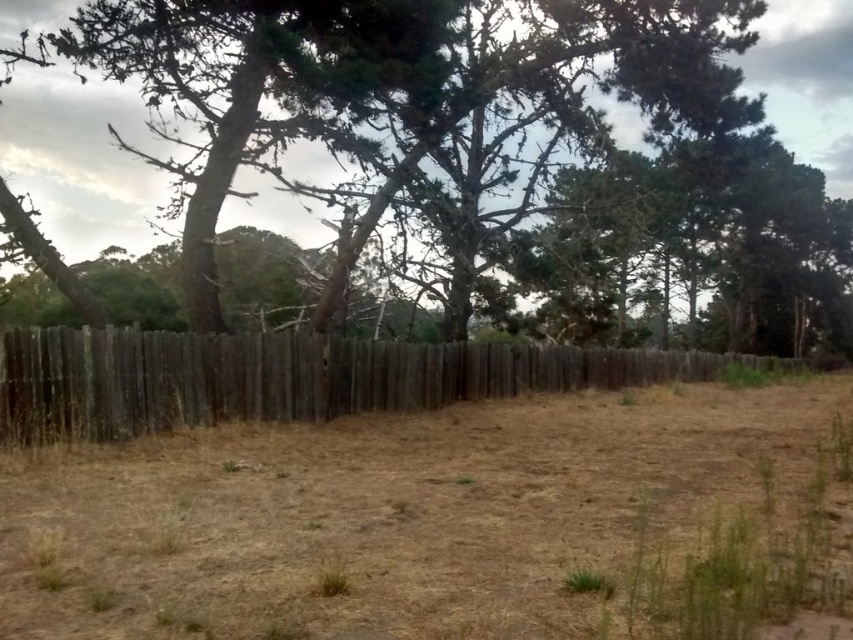
Can you confirm if brown dry soil at center is taller than green textured tree at center?

No.

Can you confirm if brown dry soil at center is positioned to the left of green textured tree at center?

Correct, you'll find brown dry soil at center to the left of green textured tree at center.

Who is more forward, (73, 621) or (91, 108)?

Point (73, 621) is more forward.

The height and width of the screenshot is (640, 853). Find the location of `brown dry soil at center`. brown dry soil at center is located at coordinates (390, 513).

Is weathered wood fence at center positioned in front of green textured tree at center?

Yes, it is.

Who is more forward, (16,410) or (828,3)?

Point (16,410)

Where is `weathered wood fence at center`? Image resolution: width=853 pixels, height=640 pixels. weathered wood fence at center is located at coordinates [x=289, y=376].

Who is higher up, brown dry soil at center or weathered wood fence at center?

Positioned higher is weathered wood fence at center.

Is brown dry soil at center to the left of weathered wood fence at center from the viewer's perspective?

Indeed, brown dry soil at center is positioned on the left side of weathered wood fence at center.

Locate an element on the screen. brown dry soil at center is located at coordinates (390, 513).